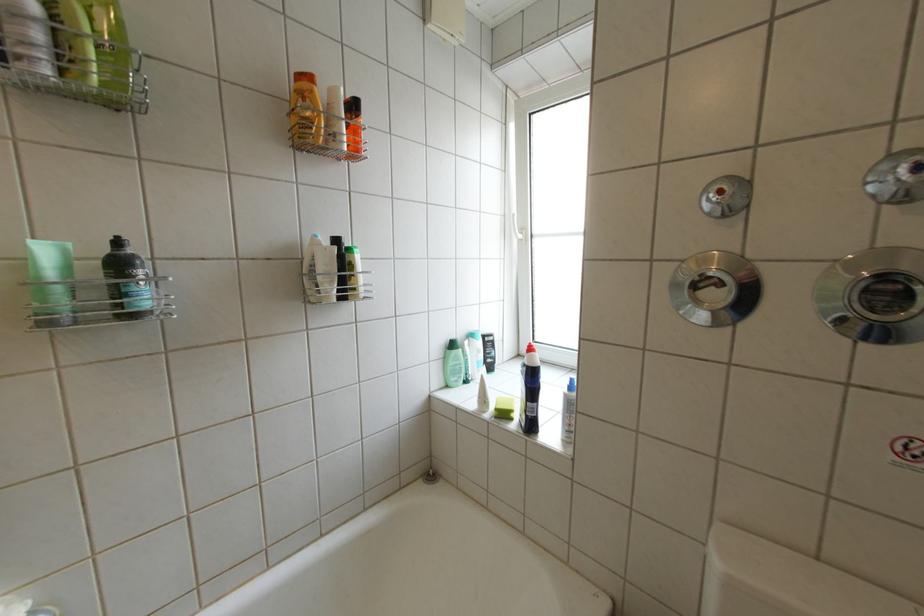
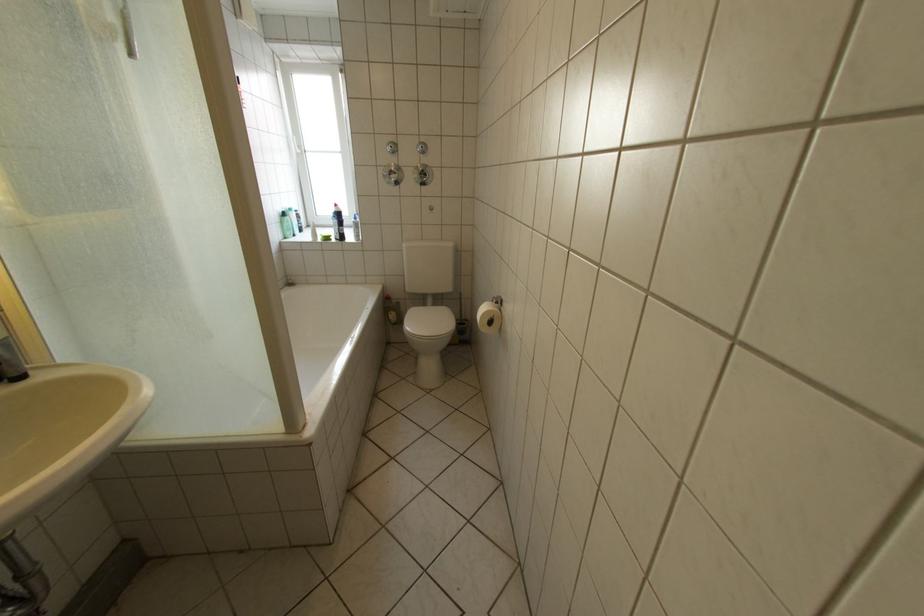
Locate, in the second image, the point that corresponds to [456,359] in the first image.

(294, 224)